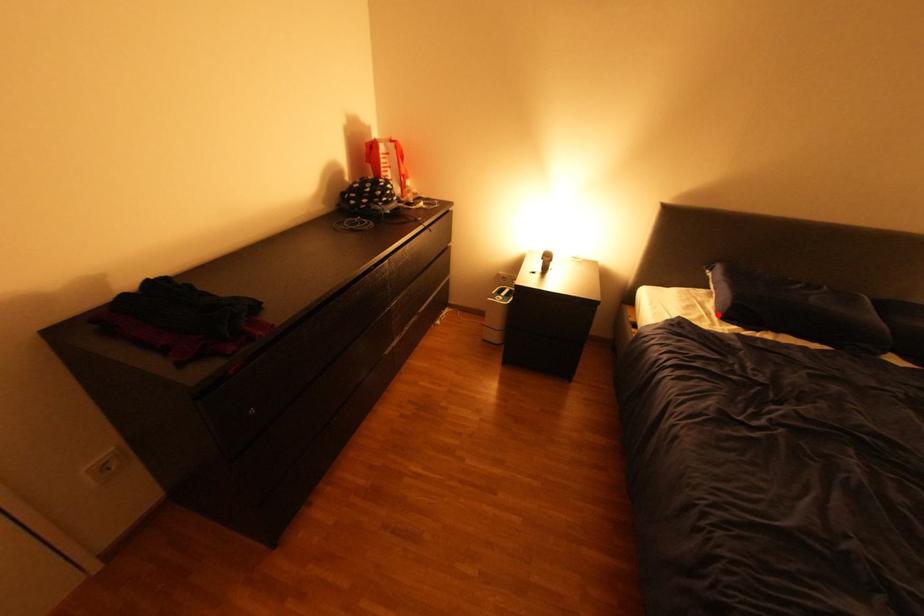
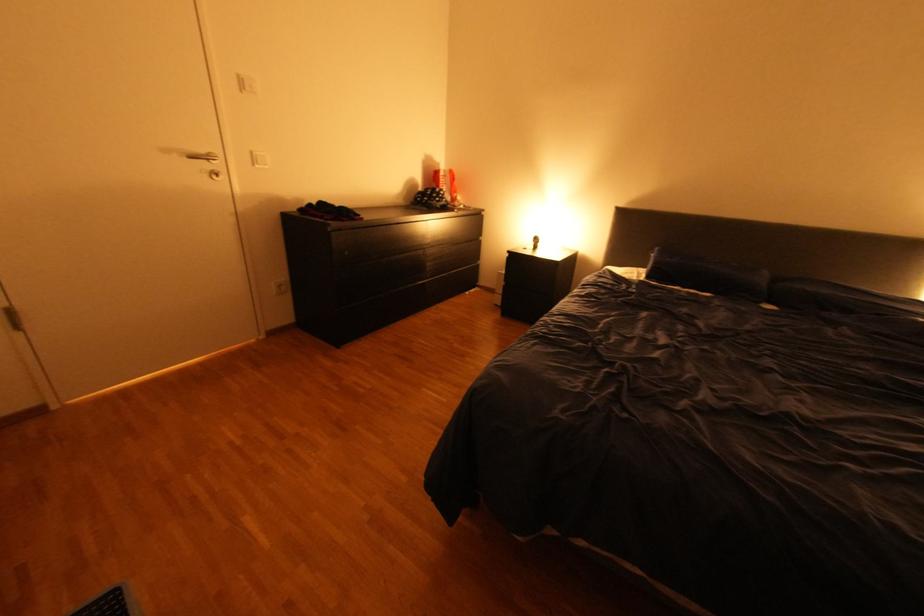
In the second image, find the point that corresponds to the highlighted location in the first image.

(648, 277)